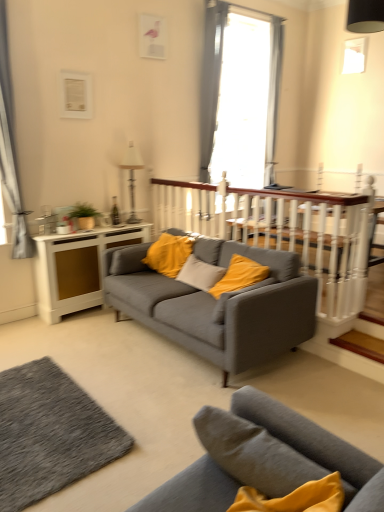
Question: Should I look upward or downward to see gray fabric curtain at left, the second curtain positioned from the back?

Choices:
 (A) down
 (B) up

Answer: (B)

Question: Is gray fabric curtain at upper center, which is the 2th curtain from front to back, bigger than white wooden balustrade at center?

Choices:
 (A) no
 (B) yes

Answer: (A)

Question: Is gray fabric curtain at upper center, marked as the 1th curtain in a back-to-front arrangement, closer to camera compared to white wooden balustrade at center?

Choices:
 (A) yes
 (B) no

Answer: (B)

Question: Is white wooden balustrade at center completely or partially inside gray fabric curtain at upper center, marked as the 1th curtain in a back-to-front arrangement?

Choices:
 (A) no
 (B) yes

Answer: (A)

Question: Is gray fabric curtain at upper center, marked as the 1th curtain in a back-to-front arrangement, at the left side of white wooden balustrade at center?

Choices:
 (A) no
 (B) yes

Answer: (B)

Question: Are gray fabric curtain at upper center, placed as the second curtain when sorted from left to right, and white wooden balustrade at center beside each other?

Choices:
 (A) no
 (B) yes

Answer: (A)

Question: Considering the relative sizes of gray fabric curtain at upper center, which is the 2th curtain from front to back, and white wooden balustrade at center in the image provided, is gray fabric curtain at upper center, which is the 2th curtain from front to back, smaller than white wooden balustrade at center?

Choices:
 (A) no
 (B) yes

Answer: (B)

Question: Does matte gray couch at center, the 2th studio couch positioned from the back, have a larger size compared to metallic silver lamp at upper center?

Choices:
 (A) no
 (B) yes

Answer: (B)

Question: From a real-world perspective, is matte gray couch at center, which is counted as the first studio couch, starting from the front, beneath metallic silver lamp at upper center?

Choices:
 (A) yes
 (B) no

Answer: (A)

Question: Is matte gray couch at center, the 2th studio couch positioned from the back, next to metallic silver lamp at upper center and touching it?

Choices:
 (A) no
 (B) yes

Answer: (A)

Question: Would you say matte gray couch at center, the 2th studio couch positioned from the back, contains metallic silver lamp at upper center?

Choices:
 (A) yes
 (B) no

Answer: (B)

Question: Can we say matte gray couch at center, which is counted as the first studio couch, starting from the front, lies outside metallic silver lamp at upper center?

Choices:
 (A) no
 (B) yes

Answer: (B)

Question: Can you confirm if matte gray couch at center, the 2th studio couch positioned from the back, is positioned to the right of metallic silver lamp at upper center?

Choices:
 (A) no
 (B) yes

Answer: (B)

Question: Would you say gray fabric curtain at upper center, which appears as the 1th curtain when viewed from the right, is part of white wooden balustrade at center's contents?

Choices:
 (A) no
 (B) yes

Answer: (A)